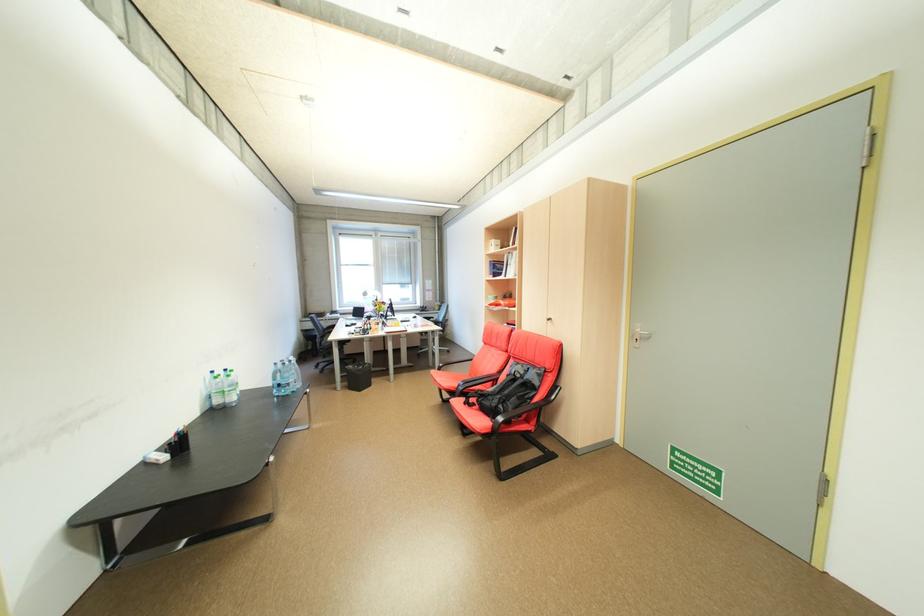
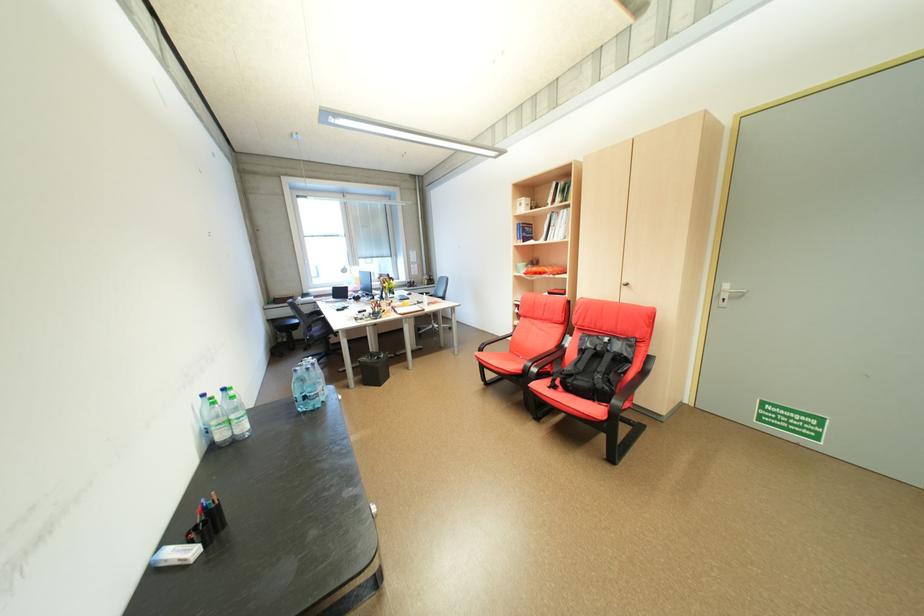
The point at [222,373] is marked in the first image. Where is the corresponding point in the second image?

(213, 395)